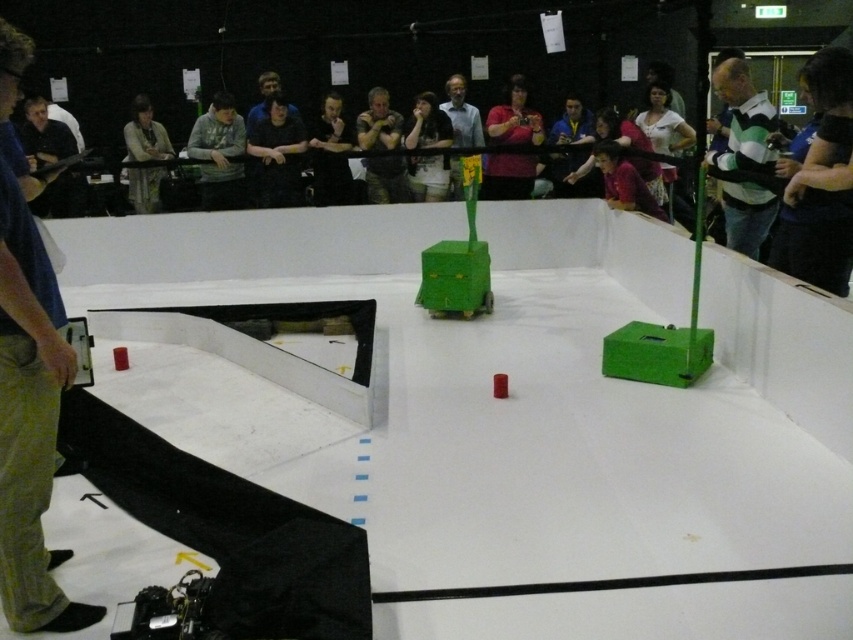
Question: Can you confirm if gray matte jacket at upper center is positioned to the right of matte black shirt at upper left?

Choices:
 (A) no
 (B) yes

Answer: (B)

Question: Among these objects, which one is farthest from the camera?

Choices:
 (A) gray matte jacket at upper center
 (B) matte pink shirt at center
 (C) dark gray fabric shirt at center

Answer: (B)

Question: Is dark blue fabric at upper right in front of dark gray fabric shirt at center?

Choices:
 (A) no
 (B) yes

Answer: (B)

Question: Does matte black guitar at left have a greater width compared to dark brown hair at upper center?

Choices:
 (A) yes
 (B) no

Answer: (A)

Question: Which of these objects is positioned farthest from the blue jeans at left?

Choices:
 (A) green striped shirt at upper right
 (B) matte black shirt at upper left

Answer: (B)

Question: Which of the following is the closest to the observer?

Choices:
 (A) (137, 150)
 (B) (457, 138)
 (C) (39, 108)
 (D) (369, 168)

Answer: (C)